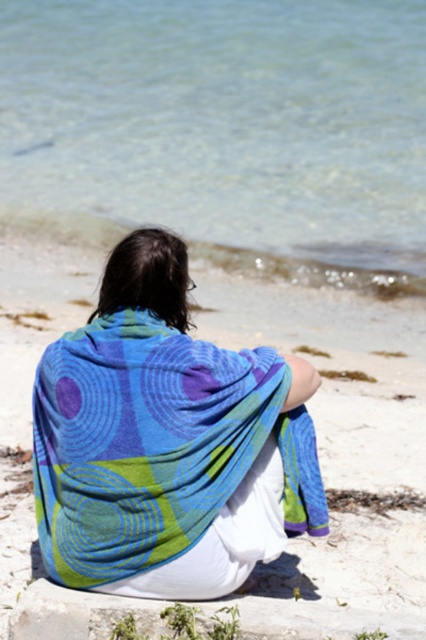
Is the position of clear water at upper center more distant than that of textured cotton blanket at center?

Yes, clear water at upper center is further from the viewer.

Image resolution: width=426 pixels, height=640 pixels. I want to click on clear water at upper center, so click(x=224, y=131).